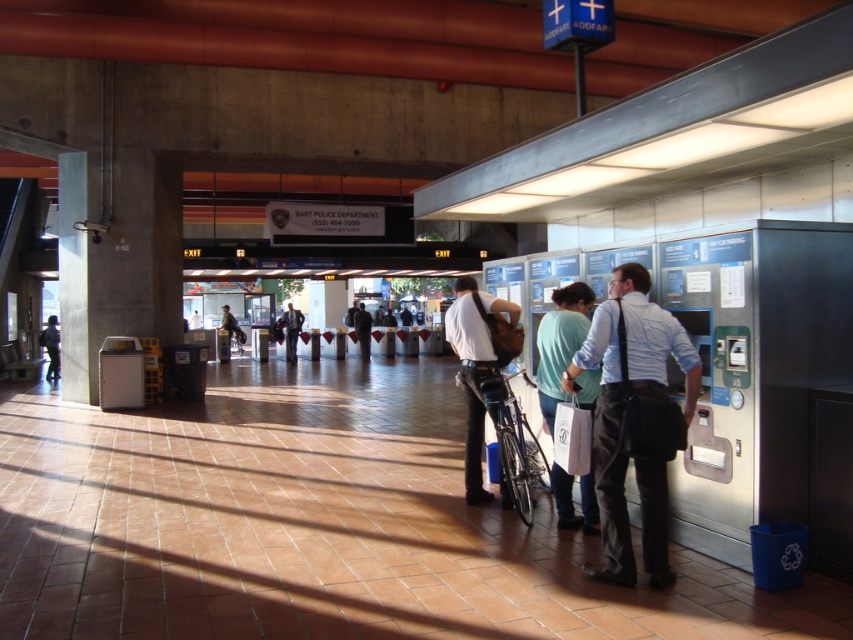
You are a maintenance worker who needs to reach both the white shirt and dark pants at center and the dark gray suit at center in the transportation hub. Given that your maintenance cart is 2 meters long, can you maneuver it between these two individuals without hitting either of them?

The distance between the white shirt and dark pants at center and the dark gray suit at center is 18.07 meters. Since your cart is only 2 meters long, there is sufficient space to maneuver between them without any issues.